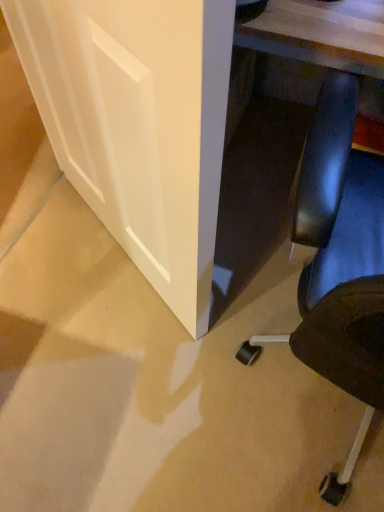
Question: Is black leather chair at lower right at the right side of white matte door at lower left?

Choices:
 (A) no
 (B) yes

Answer: (B)

Question: Is the depth of black leather chair at lower right less than that of white matte door at lower left?

Choices:
 (A) yes
 (B) no

Answer: (A)

Question: Is black leather chair at lower right positioned beyond the bounds of white matte door at lower left?

Choices:
 (A) yes
 (B) no

Answer: (A)

Question: Is black leather chair at lower right at the left side of white matte door at lower left?

Choices:
 (A) yes
 (B) no

Answer: (B)

Question: Is white matte door at lower left located within black leather chair at lower right?

Choices:
 (A) yes
 (B) no

Answer: (B)

Question: From a real-world perspective, is black leather chair at lower right under white matte door at lower left?

Choices:
 (A) yes
 (B) no

Answer: (B)

Question: Is white matte door at lower left positioned far away from black leather chair at lower right?

Choices:
 (A) no
 (B) yes

Answer: (A)

Question: From a real-world perspective, is white matte door at lower left under black leather chair at lower right?

Choices:
 (A) yes
 (B) no

Answer: (A)

Question: Can you confirm if white matte door at lower left is taller than black leather chair at lower right?

Choices:
 (A) yes
 (B) no

Answer: (B)

Question: From the image's perspective, is white matte door at lower left on top of black leather chair at lower right?

Choices:
 (A) yes
 (B) no

Answer: (A)

Question: From the image's perspective, is white matte door at lower left under black leather chair at lower right?

Choices:
 (A) no
 (B) yes

Answer: (A)

Question: Could you tell me if white matte door at lower left is turned towards black leather chair at lower right?

Choices:
 (A) yes
 (B) no

Answer: (B)

Question: From a real-world perspective, is white matte door at lower left positioned above or below black leather chair at lower right?

Choices:
 (A) below
 (B) above

Answer: (A)